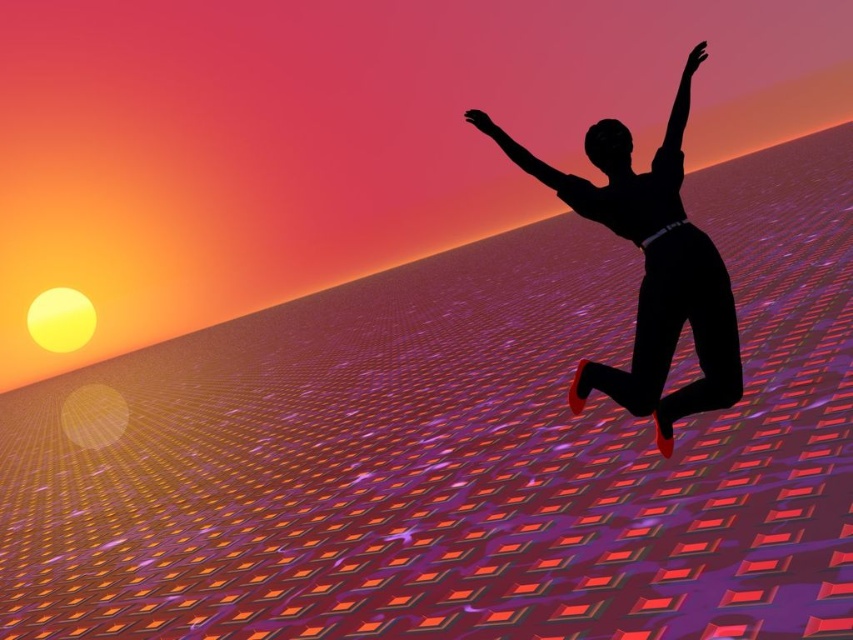
Question: Estimate the real-world distances between objects in this image. Which object is closer to the black matte arm at upper right?

Choices:
 (A) black matte arm at upper center
 (B) black matte figure at upper right

Answer: (A)

Question: Which point is farther to the camera?

Choices:
 (A) (593, 372)
 (B) (680, 164)

Answer: (A)

Question: Which of the following is the closest to the observer?

Choices:
 (A) (677, 157)
 (B) (577, 200)
 (C) (566, 179)

Answer: (B)

Question: Observing the image, what is the correct spatial positioning of black matte arm at upper center in reference to black matte arm at upper right?

Choices:
 (A) below
 (B) above

Answer: (A)

Question: Can you confirm if black matte figure at upper right is positioned below black matte arm at upper right?

Choices:
 (A) yes
 (B) no

Answer: (A)

Question: Is black matte figure at upper right positioned before black matte arm at upper center?

Choices:
 (A) yes
 (B) no

Answer: (A)